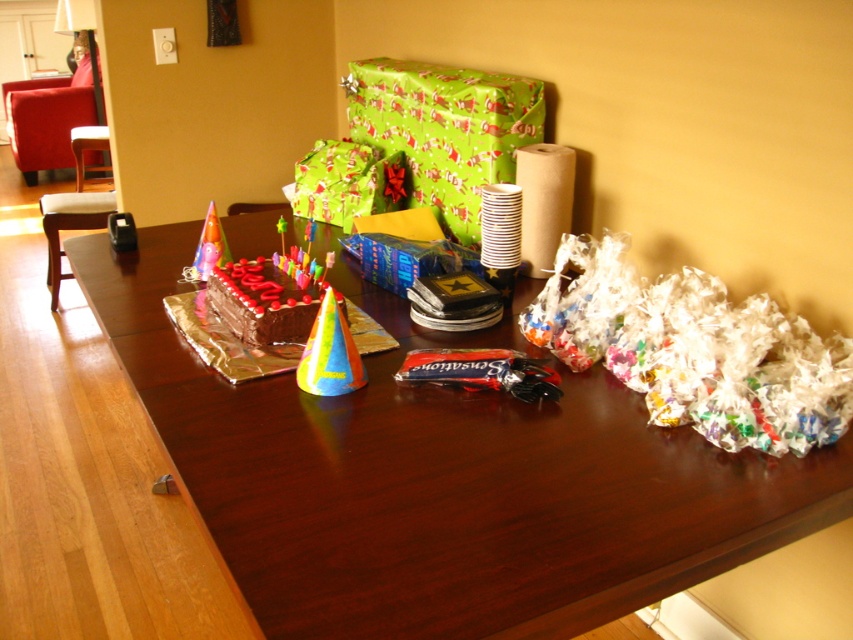
Who is lower down, dark wood table at center or matte paper party hat at center?

Positioned lower is dark wood table at center.

Is dark wood table at center behind matte paper party hat at center?

No, dark wood table at center is in front of matte paper party hat at center.

Who is more forward, (346,529) or (202,234)?

Positioned in front is point (346,529).

You are a GUI agent. You are given a task and a screenshot of the screen. Output one action in this format:
    pyautogui.click(x=<x>, y=<y>)
    Task: Click on the dark wood table at center
    
    Given the screenshot: What is the action you would take?
    pyautogui.click(x=440, y=480)

Can you confirm if dark wood table at center is positioned to the left of green shiny wrapping paper at upper center?

Correct, you'll find dark wood table at center to the left of green shiny wrapping paper at upper center.

Is dark wood table at center above green shiny wrapping paper at upper center?

No, dark wood table at center is not above green shiny wrapping paper at upper center.

Who is more forward, (341, 404) or (515, 134)?

Point (341, 404) is in front.

Identify the location of dark wood table at center. The height and width of the screenshot is (640, 853). (440, 480).

Does white crinkled paper at right appear on the left side of matte paper party hat at center?

In fact, white crinkled paper at right is to the right of matte paper party hat at center.

Is white crinkled paper at right wider than matte paper party hat at center?

Indeed, white crinkled paper at right has a greater width compared to matte paper party hat at center.

The width and height of the screenshot is (853, 640). What are the coordinates of `white crinkled paper at right` in the screenshot? It's located at (695, 349).